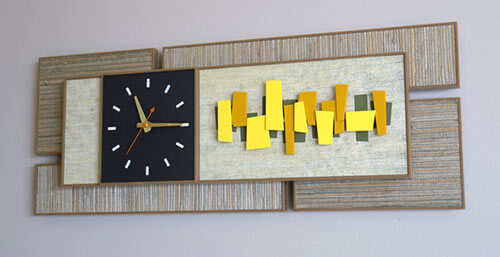
Identify the location of tan wood. (80, 113).